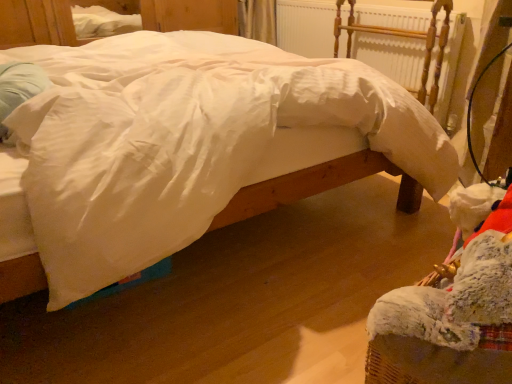
The width and height of the screenshot is (512, 384). I want to click on blank space situated above white painted wood radiator at upper center (from a real-world perspective), so click(x=357, y=2).